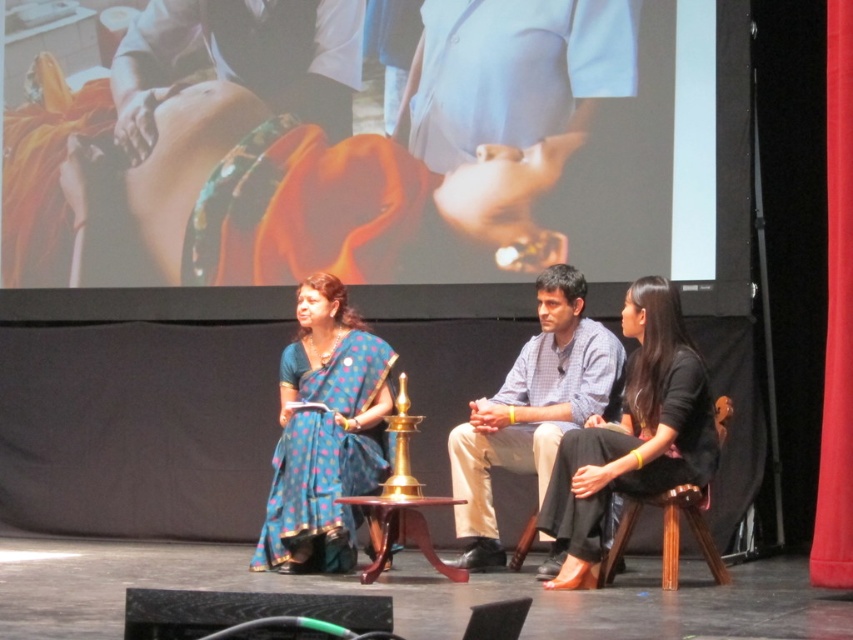
From the picture: Is red fabric curtain at right to the left of brown wooden stool at lower right from the viewer's perspective?

Incorrect, red fabric curtain at right is not on the left side of brown wooden stool at lower right.

Can you confirm if red fabric curtain at right is smaller than brown wooden stool at lower right?

Indeed, red fabric curtain at right has a smaller size compared to brown wooden stool at lower right.

Does point (843, 508) come closer to viewer compared to point (663, 538)?

Yes, point (843, 508) is in front of point (663, 538).

The image size is (853, 640). Find the location of `red fabric curtain at right`. red fabric curtain at right is located at coordinates (836, 320).

Between blue polka dot sari at center and light blue checkered shirt at center, which one appears on the left side from the viewer's perspective?

blue polka dot sari at center is more to the left.

Which is above, blue polka dot sari at center or light blue checkered shirt at center?

blue polka dot sari at center

Who is more forward, (287, 496) or (564, 346)?

Point (287, 496) is in front.

This screenshot has width=853, height=640. Find the location of `blue polka dot sari at center`. blue polka dot sari at center is located at coordinates (325, 433).

Which is in front, point (651, 275) or point (839, 262)?

Point (839, 262)

Does point (612, 476) come farther from viewer compared to point (828, 342)?

Yes, point (612, 476) is behind point (828, 342).

Image resolution: width=853 pixels, height=640 pixels. I want to click on black matte dress at center, so click(631, 435).